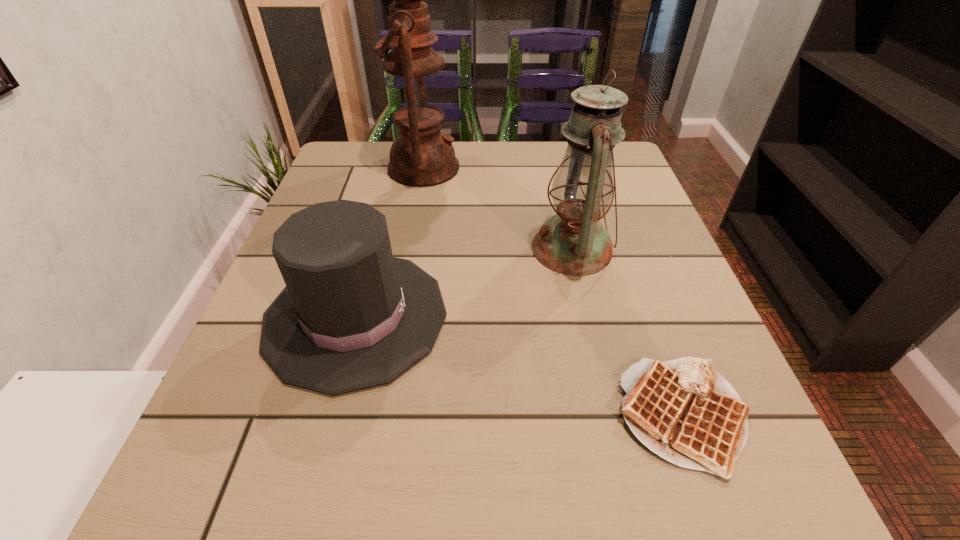
In order to click on the left oil lamp in this screenshot , I will do `click(421, 156)`.

Where is `the farthest object`? the farthest object is located at coordinates (421, 156).

At what (x,y) coordinates should I click in order to perform the action: click on the right oil lamp. Please return your answer as a coordinate pair (x, y). Image resolution: width=960 pixels, height=540 pixels. Looking at the image, I should click on (573, 242).

Locate an element on the screen. The height and width of the screenshot is (540, 960). the second shortest object is located at coordinates (351, 317).

Find the location of a particular element. waffle is located at coordinates (683, 410).

The height and width of the screenshot is (540, 960). I want to click on vacant space situated 0.050m on the front of the farther oil lamp, so click(417, 205).

The image size is (960, 540). What are the coordinates of `free spot located on the left of the right oil lamp` in the screenshot? It's located at (436, 248).

You are a GUI agent. You are given a task and a screenshot of the screen. Output one action in this format:
    pyautogui.click(x=<x>, y=<y>)
    Task: Click on the vacant space situated 0.270m on the front of the second shortest object with the decoration
    
    Given the screenshot: What is the action you would take?
    (607, 317)

Image resolution: width=960 pixels, height=540 pixels. I want to click on vacant space located on the back of the shortest object, so click(647, 318).

The width and height of the screenshot is (960, 540). I want to click on object located at the far edge, so click(421, 156).